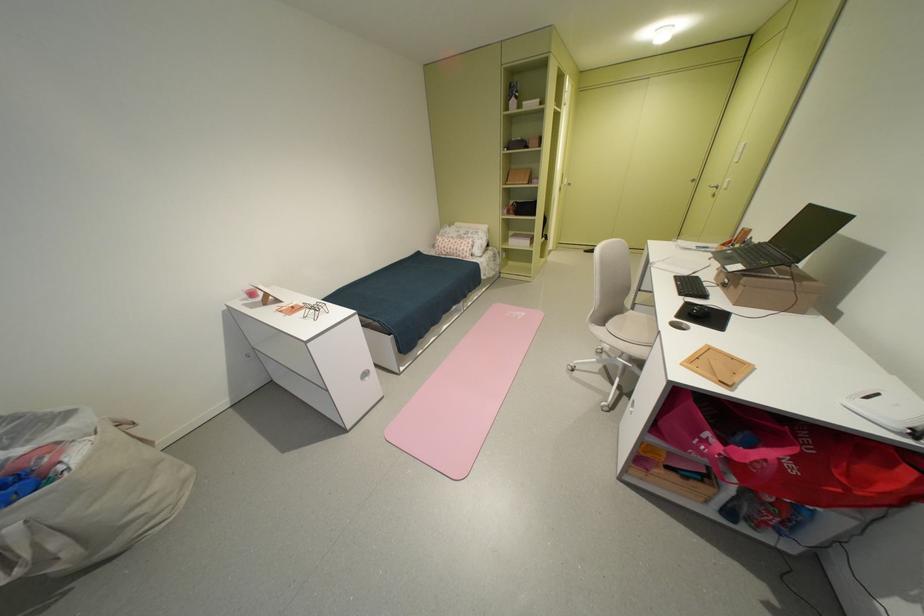
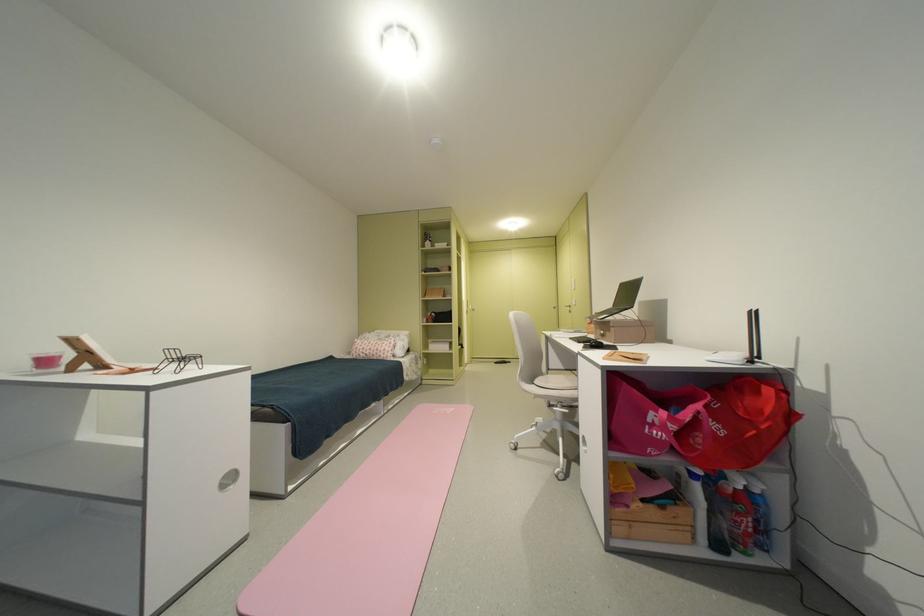
Where in the second image is the point corresponding to [468,252] from the first image?

(390, 352)